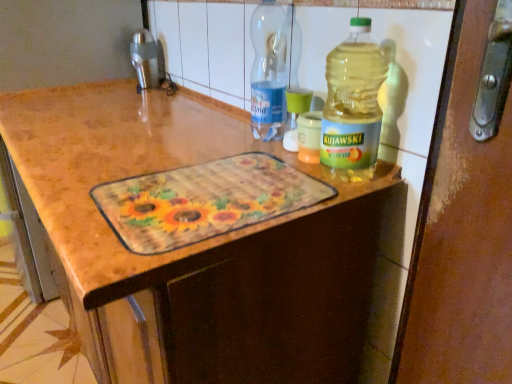
Question: Does metallic brushed faucet at upper left turn towards translucent plastic bottle at upper right, placed as the 1th bottle when sorted from right to left?

Choices:
 (A) no
 (B) yes

Answer: (A)

Question: Considering the relative positions of metallic brushed faucet at upper left and translucent plastic bottle at upper right, marked as the 2th bottle in a left-to-right arrangement, in the image provided, is metallic brushed faucet at upper left in front of translucent plastic bottle at upper right, marked as the 2th bottle in a left-to-right arrangement,?

Choices:
 (A) no
 (B) yes

Answer: (A)

Question: Considering the relative sizes of metallic brushed faucet at upper left and translucent plastic bottle at upper right, placed as the 1th bottle when sorted from right to left, in the image provided, is metallic brushed faucet at upper left smaller than translucent plastic bottle at upper right, placed as the 1th bottle when sorted from right to left,?

Choices:
 (A) no
 (B) yes

Answer: (B)

Question: Is metallic brushed faucet at upper left positioned with its back to translucent plastic bottle at upper right, marked as the 2th bottle in a left-to-right arrangement?

Choices:
 (A) no
 (B) yes

Answer: (A)

Question: Can you confirm if metallic brushed faucet at upper left is bigger than translucent plastic bottle at upper right, marked as the 2th bottle in a left-to-right arrangement?

Choices:
 (A) no
 (B) yes

Answer: (A)

Question: Is metallic brushed faucet at upper left positioned far away from translucent plastic bottle at upper right, placed as the 1th bottle when sorted from right to left?

Choices:
 (A) no
 (B) yes

Answer: (A)

Question: Considering the relative sizes of metallic brushed faucet at upper left and transparent plastic bottle at center, which ranks as the 2th bottle in front-to-back order, in the image provided, is metallic brushed faucet at upper left shorter than transparent plastic bottle at center, which ranks as the 2th bottle in front-to-back order,?

Choices:
 (A) yes
 (B) no

Answer: (A)

Question: Is metallic brushed faucet at upper left further to camera compared to transparent plastic bottle at center, which ranks as the 2th bottle in right-to-left order?

Choices:
 (A) no
 (B) yes

Answer: (B)

Question: Can we say metallic brushed faucet at upper left lies outside transparent plastic bottle at center, which ranks as the 2th bottle in right-to-left order?

Choices:
 (A) yes
 (B) no

Answer: (A)

Question: Does metallic brushed faucet at upper left have a greater height compared to transparent plastic bottle at center, which ranks as the 2th bottle in front-to-back order?

Choices:
 (A) yes
 (B) no

Answer: (B)

Question: Is metallic brushed faucet at upper left to the left of transparent plastic bottle at center, which ranks as the 2th bottle in front-to-back order, from the viewer's perspective?

Choices:
 (A) no
 (B) yes

Answer: (B)

Question: From the image's perspective, would you say metallic brushed faucet at upper left is shown under transparent plastic bottle at center, which ranks as the 2th bottle in right-to-left order?

Choices:
 (A) yes
 (B) no

Answer: (B)

Question: Is transparent plastic bottle at center, which appears as the first bottle when viewed from the back, thinner than metallic brushed faucet at upper left?

Choices:
 (A) no
 (B) yes

Answer: (A)